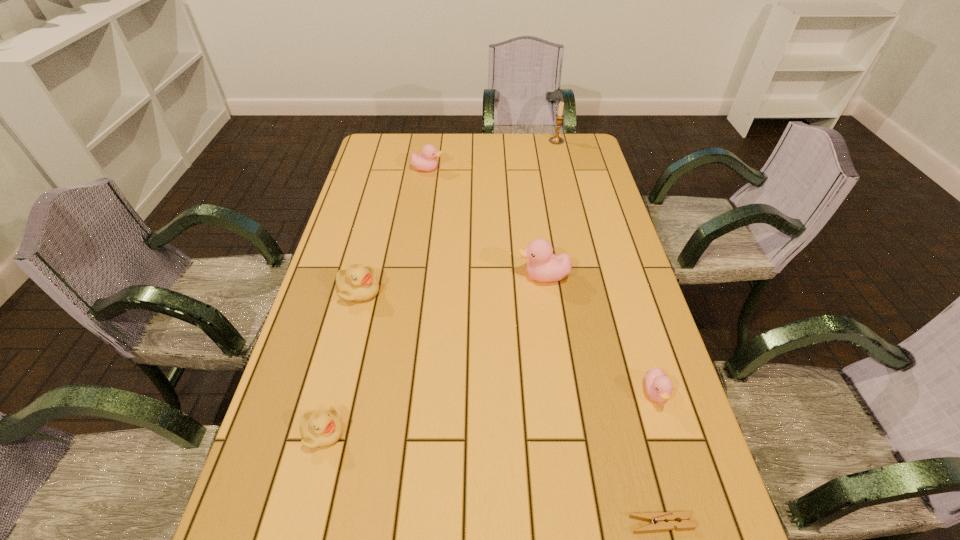
You are a GUI agent. You are given a task and a screenshot of the screen. Output one action in this format:
    pyautogui.click(x=<x>, y=<y>)
    Task: Click on the vacant space at the right edge of the desktop
    The width and height of the screenshot is (960, 540).
    Given the screenshot: What is the action you would take?
    pyautogui.click(x=611, y=261)

Find the location of a particular element. The image size is (960, 540). vacant region at the far left corner of the desktop is located at coordinates (397, 151).

The width and height of the screenshot is (960, 540). I want to click on vacant space at the far right corner of the desktop, so click(x=564, y=165).

The height and width of the screenshot is (540, 960). Identify the location of free space that is in between the fifth object from right to left and the second pink duckling from left to right. (486, 222).

You are a GUI agent. You are given a task and a screenshot of the screen. Output one action in this format:
    pyautogui.click(x=<x>, y=<y>)
    Task: Click on the unoccupied area between the bigger yellow duckling and the second nearest pink duckling
    
    Given the screenshot: What is the action you would take?
    pyautogui.click(x=451, y=284)

Locate an element on the screen. Image resolution: width=960 pixels, height=540 pixels. vacant area between the clothespin and the nearest pink duckling is located at coordinates (659, 458).

At what (x,y) coordinates should I click in order to perform the action: click on free space between the second smallest pink duckling and the smaller yellow duckling. Please return your answer as a coordinate pair (x, y). This screenshot has height=540, width=960. Looking at the image, I should click on (375, 300).

Where is `vacant point located between the second tallest object and the second smallest pink duckling`? The height and width of the screenshot is (540, 960). vacant point located between the second tallest object and the second smallest pink duckling is located at coordinates (486, 222).

Choose which object is the sixth nearest neighbor to the smaller yellow duckling. Please provide its 2D coordinates. Your answer should be formatted as a tuple, i.e. [(x, y)], where the tuple contains the x and y coordinates of a point satisfying the conditions above.

[(556, 140)]

The height and width of the screenshot is (540, 960). Find the location of `object that stands as the closest to the shortest object`. object that stands as the closest to the shortest object is located at coordinates (658, 385).